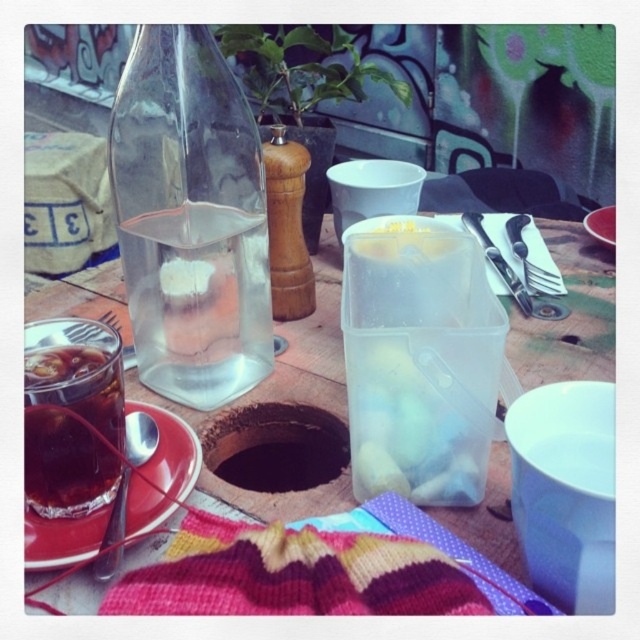
Which is above, matte ceramic plate at lower left or shiny metal knife at upper right?

Positioned higher is shiny metal knife at upper right.

Can you confirm if matte ceramic plate at lower left is thinner than shiny metal knife at upper right?

In fact, matte ceramic plate at lower left might be wider than shiny metal knife at upper right.

You are a GUI agent. You are given a task and a screenshot of the screen. Output one action in this format:
    pyautogui.click(x=<x>, y=<y>)
    Task: Click on the matte ceramic plate at lower left
    
    Given the screenshot: What is the action you would take?
    pyautogui.click(x=163, y=472)

Is point (364, 572) closer to viewer compared to point (97, 448)?

Yes, point (364, 572) is in front of point (97, 448).

Is knitted woolen blanket at lower center taller than dark brown glass at lower left?

Answer: In fact, knitted woolen blanket at lower center may be shorter than dark brown glass at lower left.

The width and height of the screenshot is (640, 640). Identify the location of knitted woolen blanket at lower center. (292, 573).

The height and width of the screenshot is (640, 640). In order to click on knitted woolen blanket at lower center in this screenshot , I will do `click(292, 573)`.

Between transparent glass bottle at center and shiny metal spoon at lower left, which one has less height?

shiny metal spoon at lower left is shorter.

Is transparent glass bottle at center taller than shiny metal spoon at lower left?

Yes.

Locate an element on the screen. This screenshot has width=640, height=640. transparent glass bottle at center is located at coordinates (189, 218).